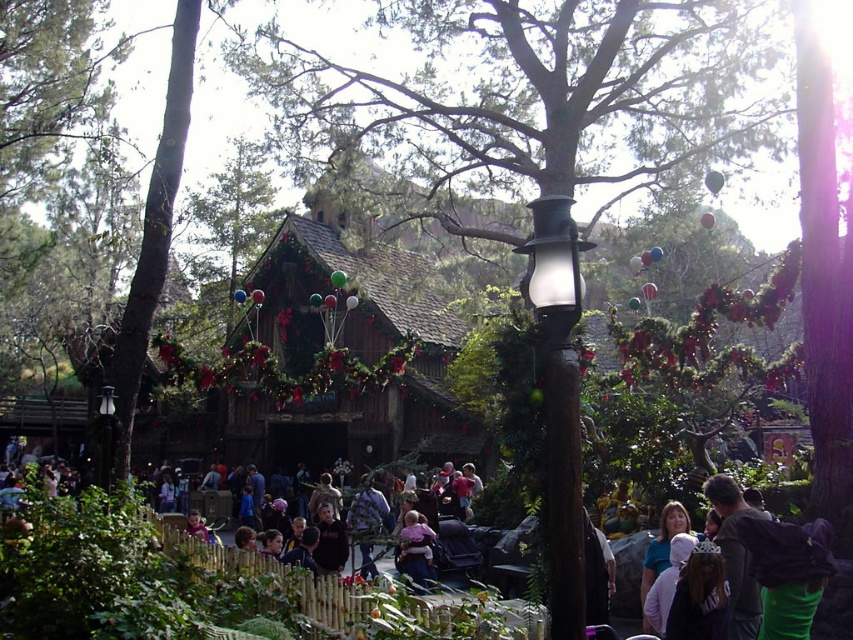
Is point (560, 506) less distant than point (103, 483)?

Yes, it is.

Where is `black wood pole at center`? black wood pole at center is located at coordinates (561, 490).

Consider the image. Which is above, wooden log cabin at center or transparent glass lamp post at upper center?

transparent glass lamp post at upper center is higher up.

Is wooden log cabin at center to the left of transparent glass lamp post at upper center from the viewer's perspective?

Indeed, wooden log cabin at center is positioned on the left side of transparent glass lamp post at upper center.

I want to click on wooden log cabin at center, so click(x=354, y=355).

The width and height of the screenshot is (853, 640). In order to click on wooden log cabin at center in this screenshot , I will do `click(354, 355)`.

Does wooden log cabin at center appear under matte black lamp post at left?

Yes.

Is wooden log cabin at center wider than matte black lamp post at left?

Yes.

Who is more distant from viewer, (276, 429) or (109, 401)?

The point (276, 429) is behind.

The width and height of the screenshot is (853, 640). Identify the location of wooden log cabin at center. (354, 355).